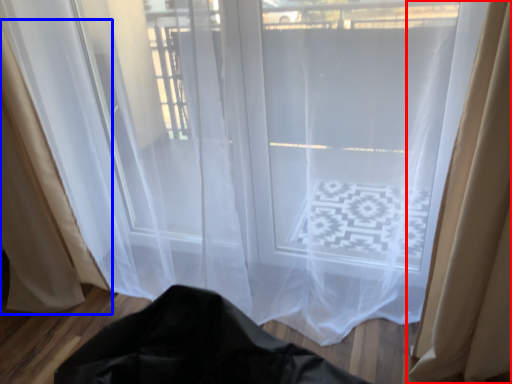
Question: Which point is closer to the camera, curtain (highlighted by a red box) or curtain (highlighted by a blue box)?

Choices:
 (A) curtain
 (B) curtain

Answer: (A)